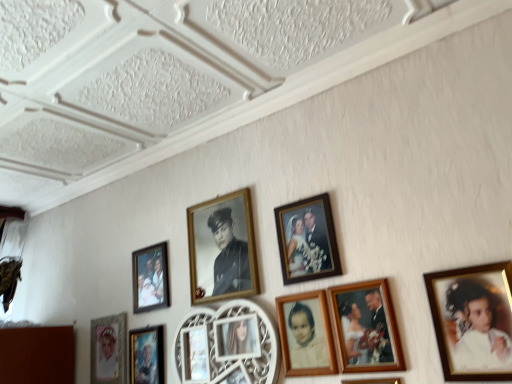
Question: Does wooden photo frame at lower center, the first picture frame in the right-to-left sequence, have a smaller size compared to matte gold picture frame at lower left, marked as the eighth picture frame in a right-to-left arrangement?

Choices:
 (A) no
 (B) yes

Answer: (B)

Question: From a real-world perspective, is wooden photo frame at lower center, the first picture frame in the right-to-left sequence, over matte gold picture frame at lower left, marked as the eighth picture frame in a right-to-left arrangement?

Choices:
 (A) no
 (B) yes

Answer: (A)

Question: Does wooden photo frame at lower center, the first picture frame in the right-to-left sequence, have a larger size compared to matte gold picture frame at lower left, marked as the first picture frame in a left-to-right arrangement?

Choices:
 (A) no
 (B) yes

Answer: (A)

Question: Are wooden photo frame at lower center, the 8th picture frame viewed from the left, and matte gold picture frame at lower left, marked as the eighth picture frame in a right-to-left arrangement, far apart?

Choices:
 (A) yes
 (B) no

Answer: (B)

Question: From a real-world perspective, does wooden photo frame at lower center, the 8th picture frame viewed from the left, sit lower than matte gold picture frame at lower left, marked as the first picture frame in a left-to-right arrangement?

Choices:
 (A) no
 (B) yes

Answer: (B)

Question: Considering the positions of point (502, 367) and point (139, 380), is point (502, 367) closer or farther from the camera than point (139, 380)?

Choices:
 (A) farther
 (B) closer

Answer: (B)

Question: From their relative heights in the image, would you say matte gold frame at upper right is taller or shorter than metallic silver portrait at lower left, the sixth picture frame when ordered from right to left?

Choices:
 (A) tall
 (B) short

Answer: (A)

Question: In the image, is matte gold frame at upper right on the left side or the right side of metallic silver portrait at lower left, the sixth picture frame when ordered from right to left?

Choices:
 (A) right
 (B) left

Answer: (A)

Question: Which is correct: matte gold frame at upper right is inside metallic silver portrait at lower left, the sixth picture frame when ordered from right to left, or outside of it?

Choices:
 (A) outside
 (B) inside

Answer: (A)

Question: From the image's perspective, is wooden photo frame at center, which is the 7th picture frame in left-to-right order, positioned above or below matte gold picture frame at lower left, marked as the first picture frame in a left-to-right arrangement?

Choices:
 (A) above
 (B) below

Answer: (A)

Question: From their relative heights in the image, would you say wooden photo frame at center, which ranks as the 2th picture frame in right-to-left order, is taller or shorter than matte gold picture frame at lower left, marked as the eighth picture frame in a right-to-left arrangement?

Choices:
 (A) tall
 (B) short

Answer: (B)

Question: Is point (374, 350) closer or farther from the camera than point (91, 367)?

Choices:
 (A) closer
 (B) farther

Answer: (A)

Question: Is wooden photo frame at center, which is the 7th picture frame in left-to-right order, inside or outside of matte gold picture frame at lower left, marked as the first picture frame in a left-to-right arrangement?

Choices:
 (A) inside
 (B) outside

Answer: (B)

Question: In terms of width, does wooden photo frame at upper center, the third picture frame in the right-to-left sequence, look wider or thinner when compared to metallic silver portrait at lower left, arranged as the third picture frame when viewed from the left?

Choices:
 (A) wide
 (B) thin

Answer: (B)

Question: From their relative heights in the image, would you say wooden photo frame at upper center, the third picture frame in the right-to-left sequence, is taller or shorter than metallic silver portrait at lower left, arranged as the third picture frame when viewed from the left?

Choices:
 (A) short
 (B) tall

Answer: (B)